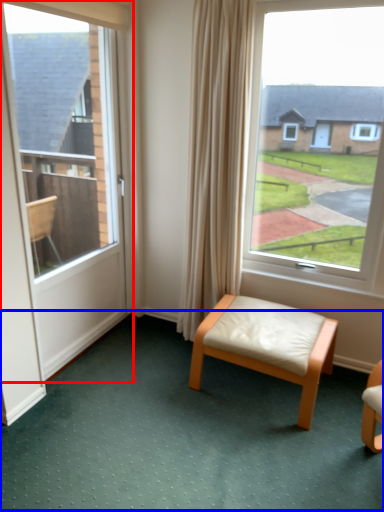
Question: Which object appears farthest to the camera in this image, door (highlighted by a red box) or golf course (highlighted by a blue box)?

Choices:
 (A) door
 (B) golf course

Answer: (A)